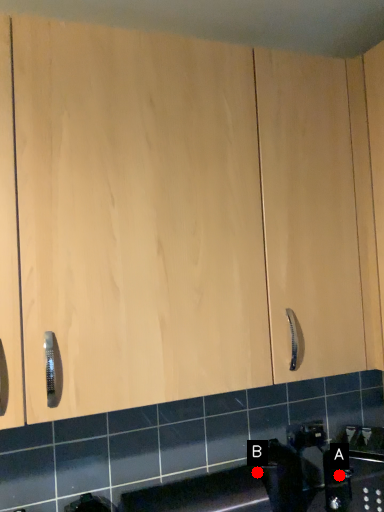
Question: Two points are circled on the image, labeled by A and B beside each circle. Which point is closer to the camera taking this photo?

Choices:
 (A) A is closer
 (B) B is closer

Answer: (B)